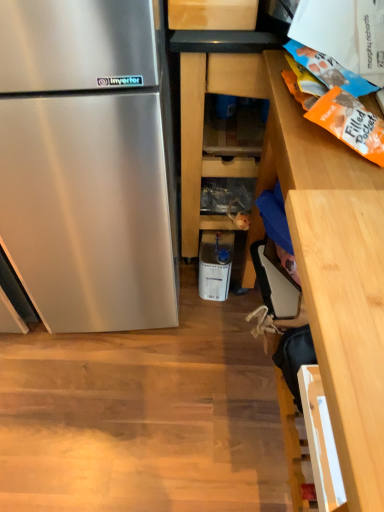
Question: From the image's perspective, is wooden cabinet at right, arranged as the first cabinetry when viewed from the right, on top of wooden shelves at center, arranged as the 1th cabinetry when viewed from the left?

Choices:
 (A) no
 (B) yes

Answer: (A)

Question: Considering the relative sizes of wooden cabinet at right, which is counted as the second cabinetry, starting from the left, and wooden shelves at center, arranged as the 1th cabinetry when viewed from the left, in the image provided, is wooden cabinet at right, which is counted as the second cabinetry, starting from the left, wider than wooden shelves at center, arranged as the 1th cabinetry when viewed from the left,?

Choices:
 (A) yes
 (B) no

Answer: (A)

Question: Can we say wooden cabinet at right, arranged as the first cabinetry when viewed from the right, lies outside wooden shelves at center, arranged as the 1th cabinetry when viewed from the left?

Choices:
 (A) no
 (B) yes

Answer: (B)

Question: Is wooden cabinet at right, which is counted as the second cabinetry, starting from the left, aimed at wooden shelves at center, which ranks as the 2th cabinetry in right-to-left order?

Choices:
 (A) no
 (B) yes

Answer: (A)

Question: Is wooden cabinet at right, arranged as the first cabinetry when viewed from the right, behind wooden shelves at center, arranged as the 1th cabinetry when viewed from the left?

Choices:
 (A) no
 (B) yes

Answer: (A)

Question: Do you think wooden shelves at center, which ranks as the 2th cabinetry in right-to-left order, is within white plastic container at center, or outside of it?

Choices:
 (A) inside
 (B) outside

Answer: (B)

Question: In terms of size, does wooden shelves at center, which ranks as the 2th cabinetry in right-to-left order, appear bigger or smaller than white plastic container at center?

Choices:
 (A) big
 (B) small

Answer: (A)

Question: Visually, is wooden shelves at center, which ranks as the 2th cabinetry in right-to-left order, positioned to the left or to the right of white plastic container at center?

Choices:
 (A) right
 (B) left

Answer: (A)

Question: From a real-world perspective, is wooden shelves at center, arranged as the 1th cabinetry when viewed from the left, physically located above or below white plastic container at center?

Choices:
 (A) above
 (B) below

Answer: (A)

Question: Visually, is white plastic container at center positioned to the left or to the right of wooden cabinet at right, which is counted as the second cabinetry, starting from the left?

Choices:
 (A) left
 (B) right

Answer: (A)

Question: Would you say white plastic container at center is inside or outside wooden cabinet at right, which is counted as the second cabinetry, starting from the left?

Choices:
 (A) outside
 (B) inside

Answer: (A)

Question: Looking at the image, does white plastic container at center seem bigger or smaller compared to wooden cabinet at right, which is counted as the second cabinetry, starting from the left?

Choices:
 (A) big
 (B) small

Answer: (B)

Question: Is white plastic container at center wider or thinner than wooden cabinet at right, which is counted as the second cabinetry, starting from the left?

Choices:
 (A) thin
 (B) wide

Answer: (A)

Question: From a real-world perspective, is wooden cabinet at right, arranged as the first cabinetry when viewed from the right, above or below white plastic container at center?

Choices:
 (A) below
 (B) above

Answer: (B)

Question: Is point (364, 450) positioned closer to the camera than point (228, 261)?

Choices:
 (A) farther
 (B) closer

Answer: (B)